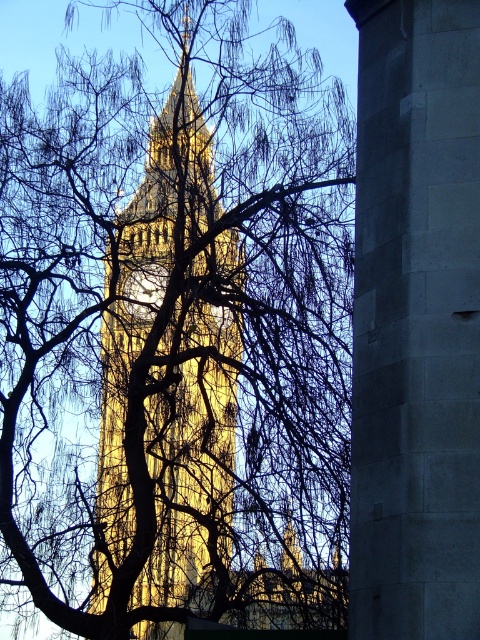
Does bare branches at center have a lesser height compared to gray stone pillar at center?

In fact, bare branches at center may be taller than gray stone pillar at center.

Is bare branches at center thinner than gray stone pillar at center?

No, bare branches at center is not thinner than gray stone pillar at center.

Is point (87, 465) positioned behind point (422, 516)?

Yes, point (87, 465) is behind point (422, 516).

This screenshot has width=480, height=640. Identify the location of bare branches at center. (177, 332).

Is bare branches at center further to the viewer compared to golden metallic clock at center?

No.

In order to click on bare branches at center in this screenshot , I will do `click(177, 332)`.

Image resolution: width=480 pixels, height=640 pixels. Find the location of `bare branches at center`. bare branches at center is located at coordinates (177, 332).

Is gray stone pillar at center in front of golden stone tower at center?

Yes, gray stone pillar at center is in front of golden stone tower at center.

Who is positioned more to the right, gray stone pillar at center or golden stone tower at center?

From the viewer's perspective, gray stone pillar at center appears more on the right side.

The image size is (480, 640). Describe the element at coordinates (416, 323) in the screenshot. I see `gray stone pillar at center` at that location.

In order to click on gray stone pillar at center in this screenshot , I will do `click(416, 323)`.